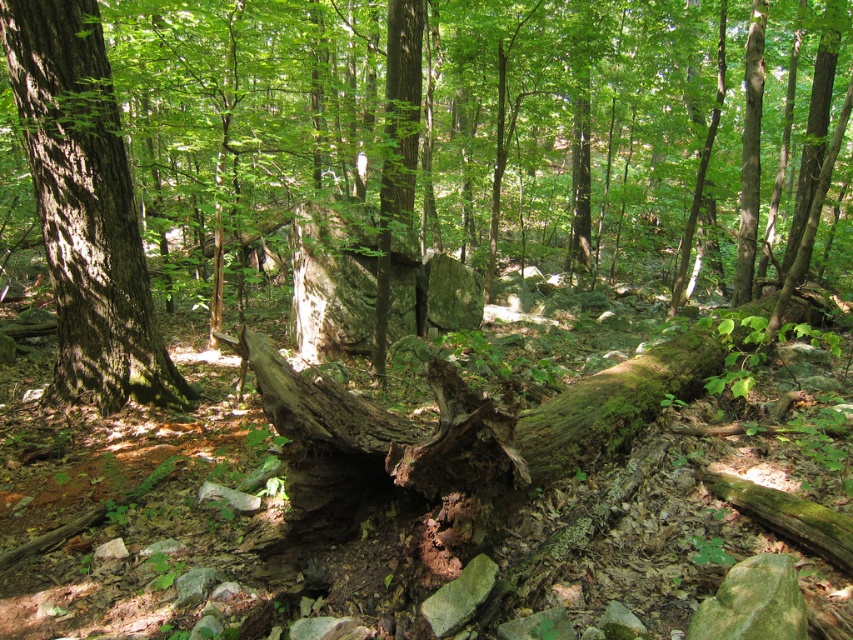
You are a park ranger assessing the forest for potential fire hazards. You notice the smooth bark tree at center and the smooth brown tree trunk at left. Which tree has a larger diameter that might make it more resistant to fire?

The smooth bark tree at center might be wider than smooth brown tree trunk at left, so it likely has a larger diameter and is more resistant to fire.

You are a hiker trying to navigate through the forest. You see a smooth bark tree at center and a smooth brown tree trunk at left. Which one would you encounter first if you walk straight ahead?

The smooth bark tree at center is closer to you than the smooth brown tree trunk at left, so you would encounter the smooth bark tree at center first.

You are a hiker trying to identify two trees in the forest. You see a smooth bark tree at center and a smooth brown tree trunk at left. Which one is taller?

The smooth bark tree at center is much taller than the smooth brown tree trunk at left.